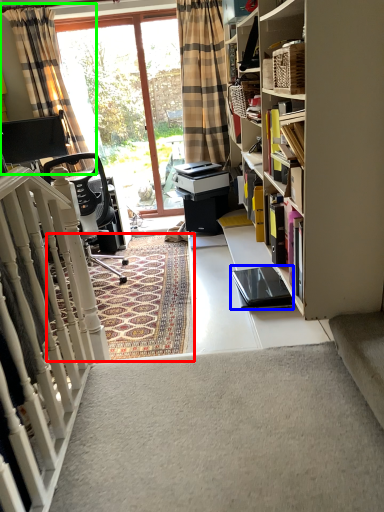
Question: Which is nearer to the mat (highlighted by a red box)? equipment (highlighted by a blue box) or curtain (highlighted by a green box).

Choices:
 (A) equipment
 (B) curtain

Answer: (A)